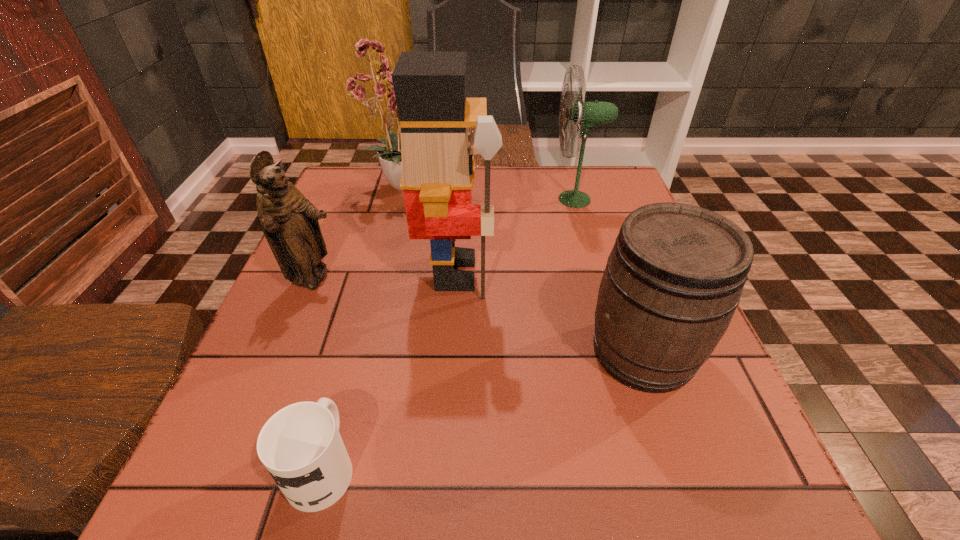
The height and width of the screenshot is (540, 960). In order to click on vacant space located on the front-facing side of the fan in this screenshot , I will do `click(416, 199)`.

Locate an element on the screen. This screenshot has width=960, height=540. free spot located 0.190m on the front-facing side of the fan is located at coordinates (478, 199).

Where is `free region located 0.090m on the front-facing side of the figurine`? The image size is (960, 540). free region located 0.090m on the front-facing side of the figurine is located at coordinates (384, 279).

The image size is (960, 540). I want to click on free space located on the back of the wine bucket, so click(592, 205).

You are a GUI agent. You are given a task and a screenshot of the screen. Output one action in this format:
    pyautogui.click(x=<x>, y=<y>)
    Task: Click on the free space located 0.120m on the handle side of the nearest object
    
    Given the screenshot: What is the action you would take?
    pyautogui.click(x=350, y=362)

I want to click on vacant space located 0.240m on the handle side of the nearest object, so click(x=364, y=311).

At what (x,y) coordinates should I click in order to perform the action: click on vacant area situated 0.080m on the handle side of the nearest object. Please return your answer as a coordinate pair (x, y). Looking at the image, I should click on (x=345, y=381).

Identify the location of flower arrangement situated at the far edge. (376, 102).

The image size is (960, 540). In order to click on fan that is at the far edge in this screenshot , I will do `click(586, 115)`.

The image size is (960, 540). Identify the location of object situated at the near edge. (301, 447).